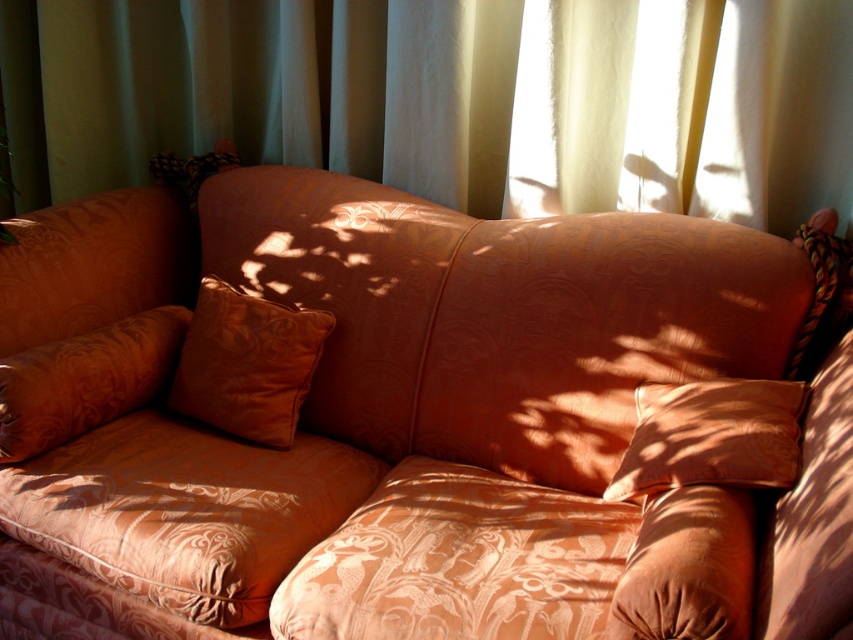
Question: Which point is farther to the camera?

Choices:
 (A) satin orange pillow at lower right
 (B) white sheer curtain at upper center
 (C) satin orange pillow at center

Answer: (C)

Question: Is white sheer curtain at upper center smaller than satin orange pillow at center?

Choices:
 (A) yes
 (B) no

Answer: (B)

Question: Which point is closer to the camera?

Choices:
 (A) (735, 429)
 (B) (289, 284)

Answer: (A)

Question: Considering the relative positions of white sheer curtain at upper center and satin orange pillow at center in the image provided, where is white sheer curtain at upper center located with respect to satin orange pillow at center?

Choices:
 (A) right
 (B) left

Answer: (A)

Question: Considering the relative positions of white sheer curtain at upper center and satin orange pillow at center in the image provided, where is white sheer curtain at upper center located with respect to satin orange pillow at center?

Choices:
 (A) below
 (B) above

Answer: (B)

Question: Which point is farther to the camera?

Choices:
 (A) white sheer curtain at upper center
 (B) satin orange pillow at center
 (C) matte orange couch at center

Answer: (B)